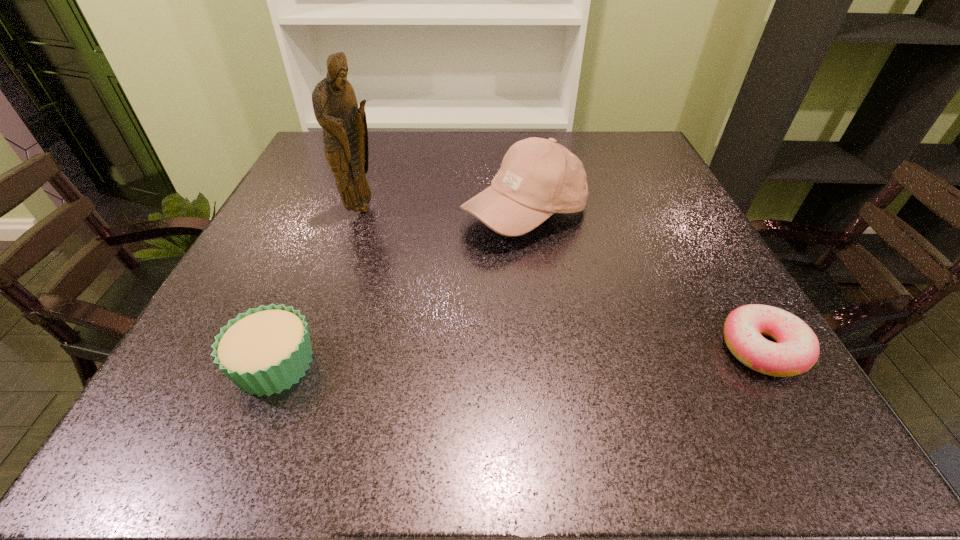
The image size is (960, 540). In order to click on cupcake in this screenshot , I will do `click(265, 350)`.

You are a GUI agent. You are given a task and a screenshot of the screen. Output one action in this format:
    pyautogui.click(x=<x>, y=<y>)
    Task: Click on the doughnut
    This screenshot has width=960, height=540.
    Given the screenshot: What is the action you would take?
    pyautogui.click(x=797, y=349)

Image resolution: width=960 pixels, height=540 pixels. Identify the location of the shortest object. (797, 349).

The width and height of the screenshot is (960, 540). Identify the location of figurine. (345, 135).

Identify the location of baseball cap. (538, 177).

Locate an element on the screen. the third object from left to right is located at coordinates (538, 177).

Locate an element on the screen. Image resolution: width=960 pixels, height=540 pixels. free space located 0.280m on the right of the cupcake is located at coordinates (499, 364).

Find the location of a particular element. This screenshot has height=540, width=960. free space located 0.150m on the left of the rightmost object is located at coordinates (627, 348).

The height and width of the screenshot is (540, 960). What are the coordinates of `vacant point located 0.180m on the front-facing side of the tallest object` in the screenshot? It's located at (419, 260).

Identify the location of free region located on the front-facing side of the tallest object. (405, 247).